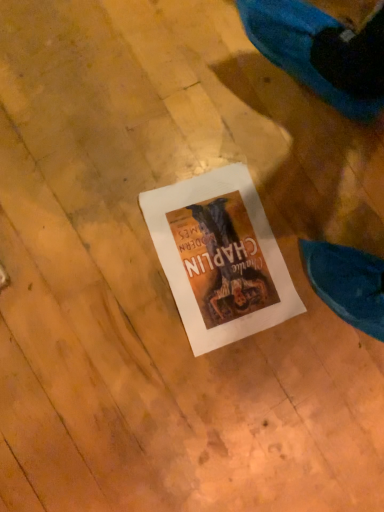
Identify the location of empty space that is ontop of white paper poster at center (from a real-world perspective). The width and height of the screenshot is (384, 512). (233, 250).